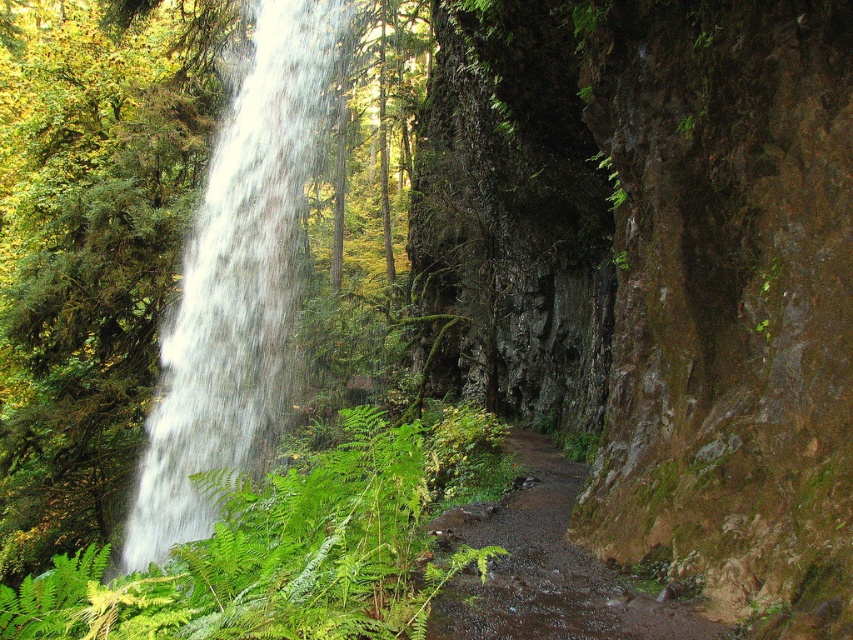
Measure the distance from white frothy water at left to damp dirt path at lower center.

A distance of 29.87 feet exists between white frothy water at left and damp dirt path at lower center.

Does white frothy water at left have a lesser width compared to damp dirt path at lower center?

No, white frothy water at left is not thinner than damp dirt path at lower center.

Where is `white frothy water at left`? This screenshot has height=640, width=853. white frothy water at left is located at coordinates (235, 284).